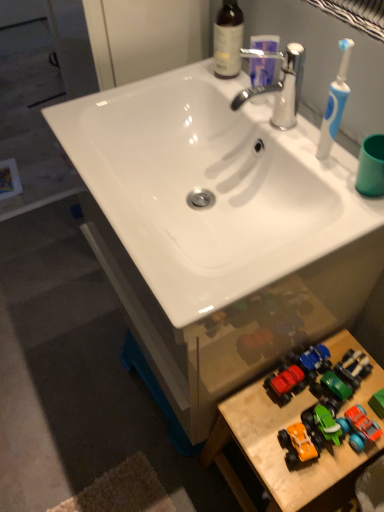
Question: Considering the relative positions of chrome metallic faucet at upper center and wooden toy cars at lower right in the image provided, is chrome metallic faucet at upper center to the right of wooden toy cars at lower right from the viewer's perspective?

Choices:
 (A) yes
 (B) no

Answer: (B)

Question: Is chrome metallic faucet at upper center facing away from wooden toy cars at lower right?

Choices:
 (A) no
 (B) yes

Answer: (A)

Question: From the image's perspective, would you say chrome metallic faucet at upper center is positioned over wooden toy cars at lower right?

Choices:
 (A) no
 (B) yes

Answer: (B)

Question: From a real-world perspective, is chrome metallic faucet at upper center below wooden toy cars at lower right?

Choices:
 (A) yes
 (B) no

Answer: (B)

Question: Can you confirm if chrome metallic faucet at upper center is bigger than wooden toy cars at lower right?

Choices:
 (A) no
 (B) yes

Answer: (A)

Question: From a real-world perspective, is orange matte toy car at lower right positioned above or below brown glass bottle at upper center?

Choices:
 (A) above
 (B) below

Answer: (B)

Question: Is orange matte toy car at lower right spatially inside brown glass bottle at upper center, or outside of it?

Choices:
 (A) inside
 (B) outside

Answer: (B)

Question: Is orange matte toy car at lower right taller or shorter than brown glass bottle at upper center?

Choices:
 (A) short
 (B) tall

Answer: (A)

Question: In the image, is orange matte toy car at lower right positioned in front of or behind brown glass bottle at upper center?

Choices:
 (A) behind
 (B) front

Answer: (B)

Question: In terms of width, does brown glass bottle at upper center look wider or thinner when compared to chrome metallic faucet at upper center?

Choices:
 (A) wide
 (B) thin

Answer: (B)

Question: From a real-world perspective, is brown glass bottle at upper center positioned above or below chrome metallic faucet at upper center?

Choices:
 (A) below
 (B) above

Answer: (B)

Question: Considering their positions, is brown glass bottle at upper center located in front of or behind chrome metallic faucet at upper center?

Choices:
 (A) front
 (B) behind

Answer: (B)

Question: From the image's perspective, relative to chrome metallic faucet at upper center, is brown glass bottle at upper center above or below?

Choices:
 (A) below
 (B) above

Answer: (B)

Question: From the image's perspective, is white glossy sink at center positioned above or below wooden toy cars at lower right?

Choices:
 (A) above
 (B) below

Answer: (A)

Question: From a real-world perspective, is white glossy sink at center positioned above or below wooden toy cars at lower right?

Choices:
 (A) below
 (B) above

Answer: (B)